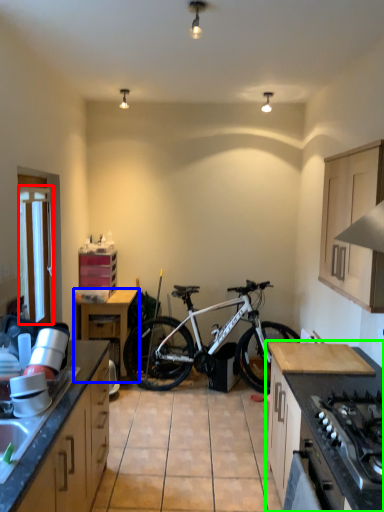
Question: Which object is positioned farthest from window screen (highlighted by a red box)? Select from table (highlighted by a blue box) and cabinetry (highlighted by a green box).

Choices:
 (A) table
 (B) cabinetry

Answer: (B)